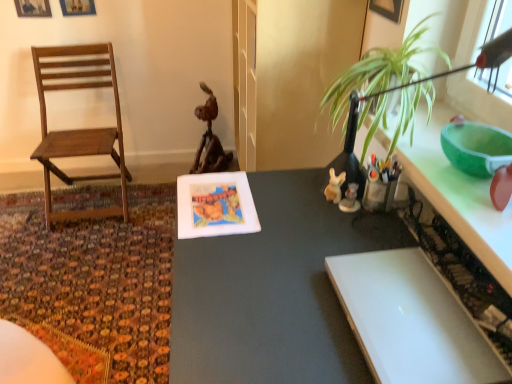
Question: Does rustic wood statue at center turn towards white glossy figurine at center-right, the 1th toy from the right?

Choices:
 (A) no
 (B) yes

Answer: (A)

Question: Is rustic wood statue at center thinner than white glossy figurine at center-right, the 1th toy from the right?

Choices:
 (A) yes
 (B) no

Answer: (B)

Question: Can you confirm if rustic wood statue at center is bigger than white glossy figurine at center-right, which is the second toy from left to right?

Choices:
 (A) yes
 (B) no

Answer: (A)

Question: Is rustic wood statue at center outside white glossy figurine at center-right, the 1th toy from the right?

Choices:
 (A) yes
 (B) no

Answer: (A)

Question: Is rustic wood statue at center positioned with its back to white glossy figurine at center-right, which is the second toy from left to right?

Choices:
 (A) yes
 (B) no

Answer: (B)

Question: Does rustic wood statue at center come behind white glossy figurine at center-right, the 1th toy from the right?

Choices:
 (A) yes
 (B) no

Answer: (A)

Question: Is green glossy counter top at upper right bigger than white glossy figurine at center-right, the 1th toy from the right?

Choices:
 (A) yes
 (B) no

Answer: (A)

Question: Is green glossy counter top at upper right next to white glossy figurine at center-right, the 1th toy from the right, and touching it?

Choices:
 (A) no
 (B) yes

Answer: (A)

Question: Is there a large distance between green glossy counter top at upper right and white glossy figurine at center-right, the 1th toy from the right?

Choices:
 (A) no
 (B) yes

Answer: (A)

Question: Can you confirm if green glossy counter top at upper right is thinner than white glossy figurine at center-right, which is the second toy from left to right?

Choices:
 (A) yes
 (B) no

Answer: (B)

Question: Is green glossy counter top at upper right positioned beyond the bounds of white glossy figurine at center-right, the 1th toy from the right?

Choices:
 (A) no
 (B) yes

Answer: (B)

Question: Does green glossy counter top at upper right appear on the right side of white glossy figurine at center-right, which is the second toy from left to right?

Choices:
 (A) yes
 (B) no

Answer: (A)

Question: Is rustic wood statue at center facing away from green glossy counter top at upper right?

Choices:
 (A) yes
 (B) no

Answer: (B)